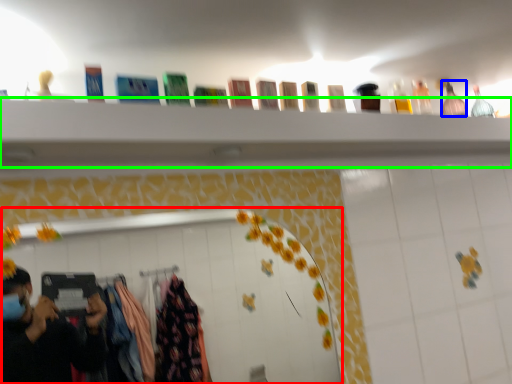
Question: Which object is positioned closest to mirror (highlighted by a red box)? Select from bottle (highlighted by a blue box) and closet (highlighted by a green box).

Choices:
 (A) bottle
 (B) closet

Answer: (B)